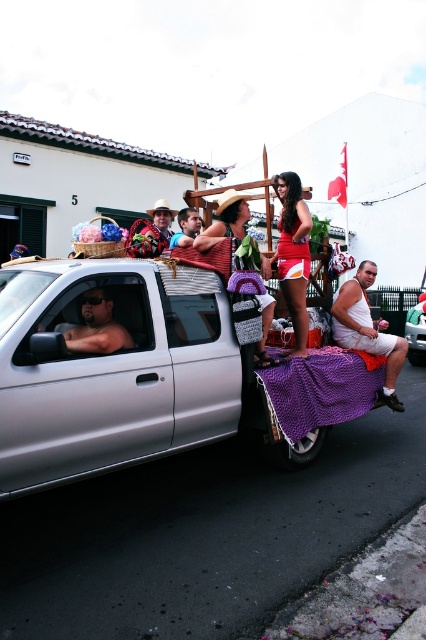
What are the coordinates of the knitted sweater at center?

The knitted sweater at center is located at point (226, 220).